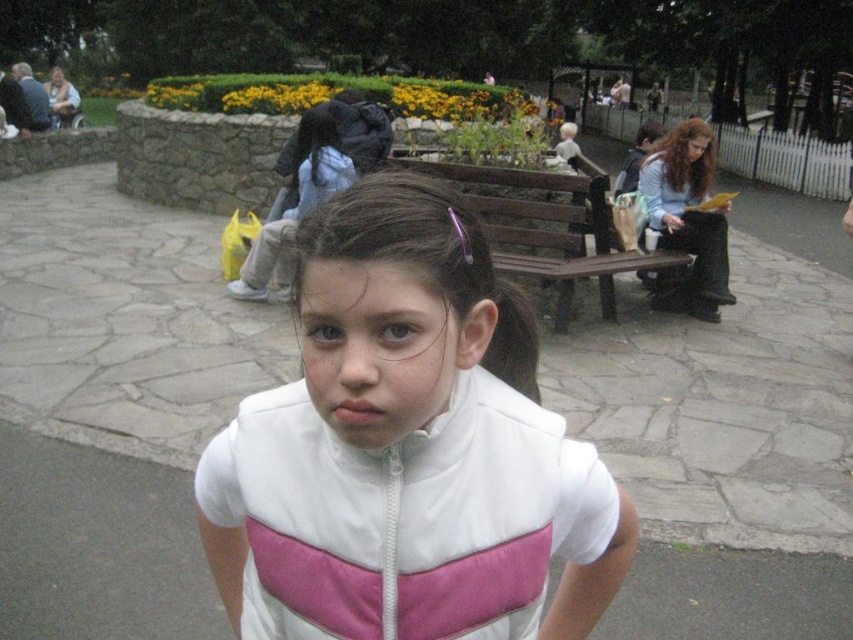
Is point (279, 609) less distant than point (595, 170)?

Yes, point (279, 609) is closer to viewer.

Is the position of white matte jacket at center less distant than that of brown wooden bench at center?

Yes, white matte jacket at center is closer to the viewer.

Find the location of a particular element. white matte jacket at center is located at coordinates (407, 449).

Can you confirm if white matte jacket at center is taller than brown hair at center?

Incorrect, white matte jacket at center's height is not larger of brown hair at center's.

Between point (421, 214) and point (717, 316), which one is positioned behind?

Point (717, 316)

Where is `white matte jacket at center`? The height and width of the screenshot is (640, 853). white matte jacket at center is located at coordinates (407, 449).

Which is in front, point (431, 161) or point (653, 211)?

Point (653, 211) is in front.

Is brown wooden bench at center to the left of brown hair at center from the viewer's perspective?

Correct, you'll find brown wooden bench at center to the left of brown hair at center.

Is point (489, 227) closer to viewer compared to point (651, 202)?

Yes, point (489, 227) is closer to viewer.

At what (x,y) coordinates should I click in order to perform the action: click on brown wooden bench at center. Please return your answer as a coordinate pair (x, y). The height and width of the screenshot is (640, 853). Looking at the image, I should click on (546, 227).